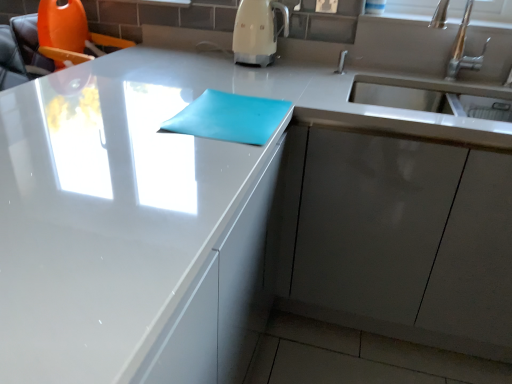
This screenshot has height=384, width=512. Identify the location of free region on the left part of white glossy coffee machine at upper center. (204, 57).